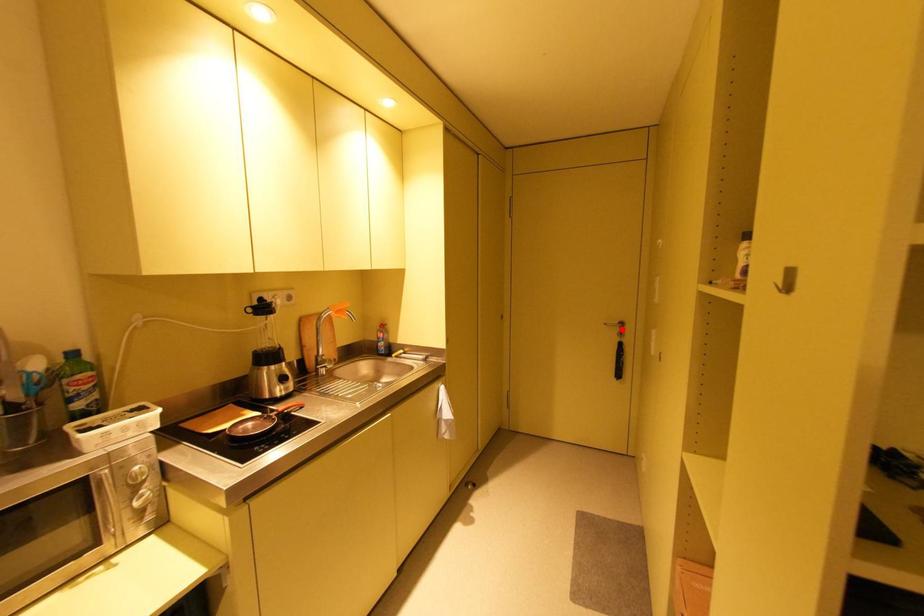
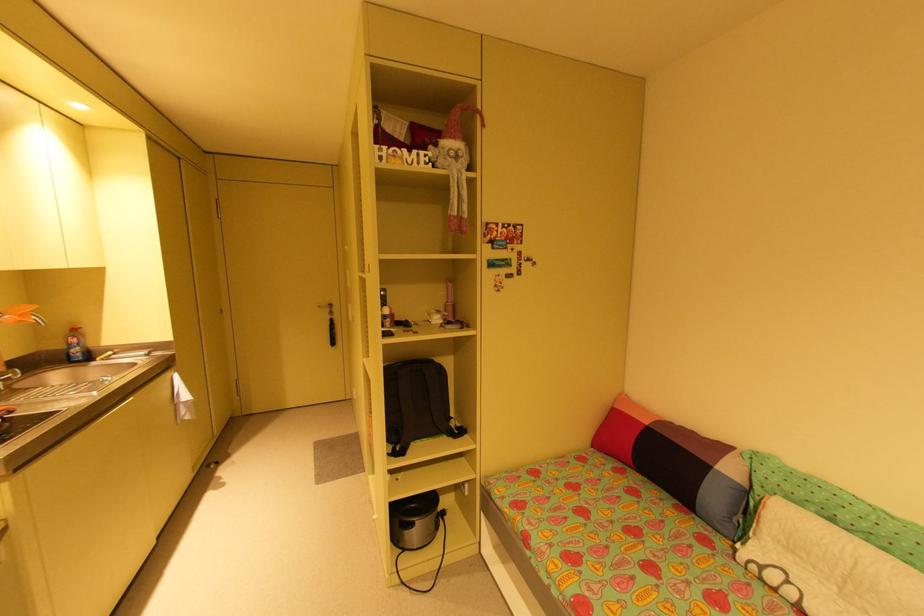
Find the pixel in the second image that matches the highlighted location in the first image.

(333, 310)